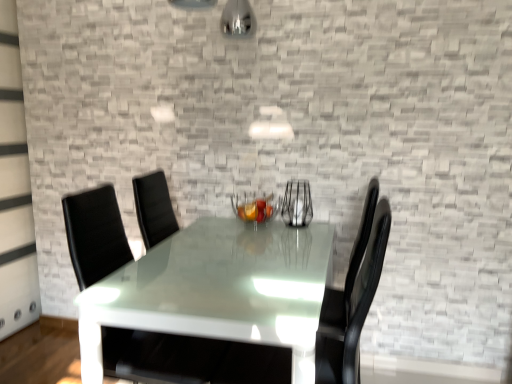
The width and height of the screenshot is (512, 384). I want to click on free location to the left of metallic wire basket at center, so pyautogui.click(x=208, y=230).